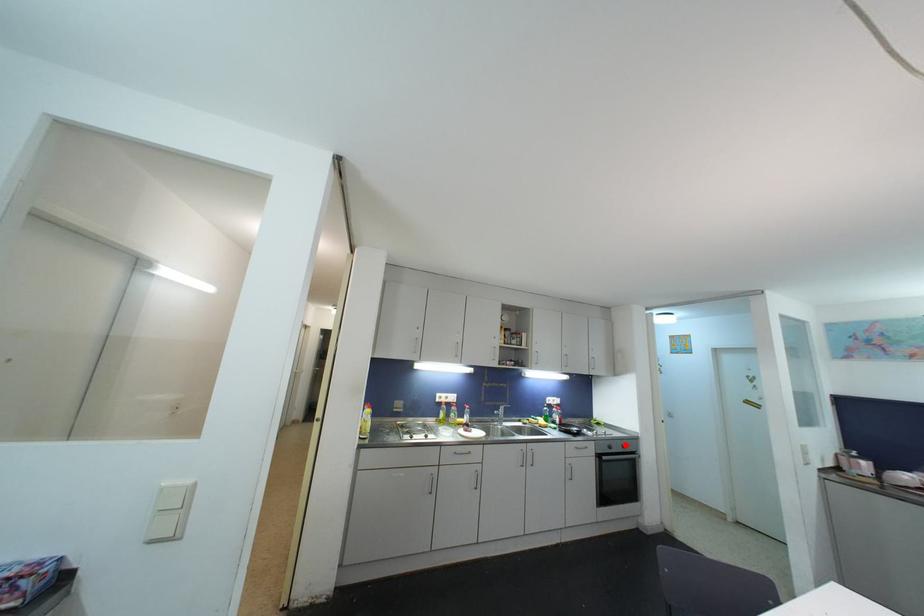
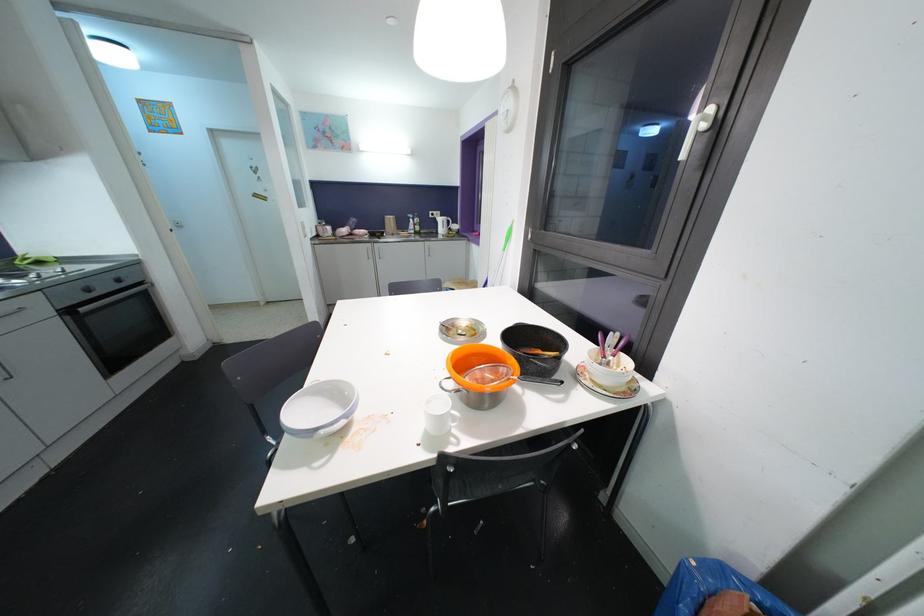
Find the pixel in the second image that matches the highlighted location in the first image.

(116, 278)